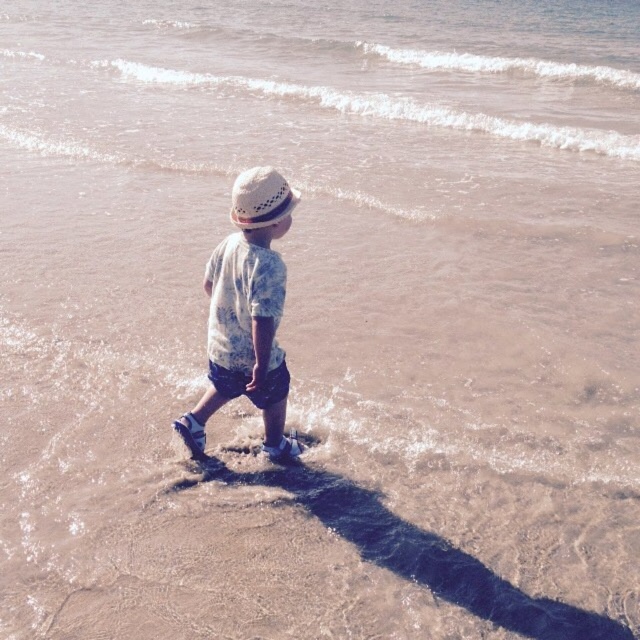
You are standing at the beach and want to take a photo of the light blue cotton shirt at center. If your camera has a maximum focus range of 4 meters, will you need to move closer to capture the shirt clearly?

The light blue cotton shirt at center is 4.24 meters away from the camera. Since the maximum focus range is 4 meters, you need to move closer to ensure the shirt is in focus.

You are a photographer standing at the shoreline. You want to take a photo of the light blue cotton shirt at center. Where should you position yourself to capture the shirt in the center of your frame?

To capture the light blue cotton shirt at center in the center of your frame, position yourself directly in line with the shirt, which is located at the coordinates point [248,314]. This will ensure the shirt is centered in your photo.